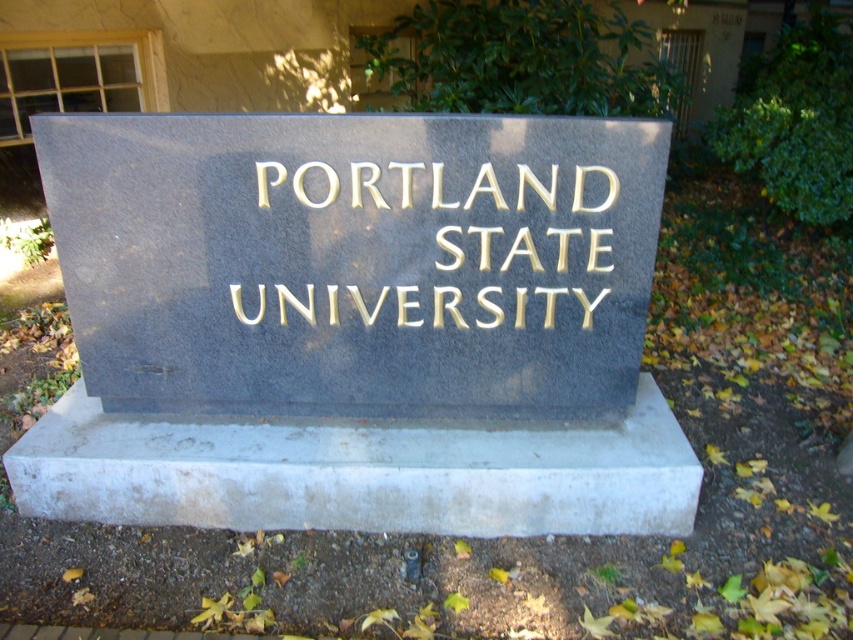
Does point (491, 518) lie in front of point (408, 172)?

No.

Is gray concrete base at center bigger than gold embossed text at center?

Yes.

Find the location of a particular element. The height and width of the screenshot is (640, 853). gray concrete base at center is located at coordinates tap(358, 472).

The image size is (853, 640). I want to click on gray concrete base at center, so click(358, 472).

Is point (534, 150) farther from camera compared to point (524, 186)?

No.

Does black granite sign at center have a lesser height compared to gold embossed text at center?

No, black granite sign at center is not shorter than gold embossed text at center.

Does point (486, 301) come behind point (399, 163)?

Yes, it is behind point (399, 163).

Locate an element on the screen. The height and width of the screenshot is (640, 853). black granite sign at center is located at coordinates (357, 260).

Does black granite sign at center appear under gray concrete base at center?

Actually, black granite sign at center is above gray concrete base at center.

Is black granite sign at center taller than gray concrete base at center?

Yes, black granite sign at center is taller than gray concrete base at center.

Is point (178, 390) more distant than point (142, 524)?

Yes, point (178, 390) is farther from viewer.

This screenshot has height=640, width=853. I want to click on black granite sign at center, so click(357, 260).